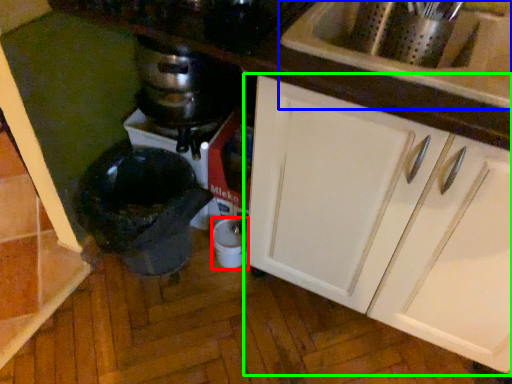
Question: Estimate the real-world distances between objects in this image. Which object is farther from appliance (highlighted by a red box), sink (highlighted by a blue box) or cabinetry (highlighted by a green box)?

Choices:
 (A) sink
 (B) cabinetry

Answer: (A)